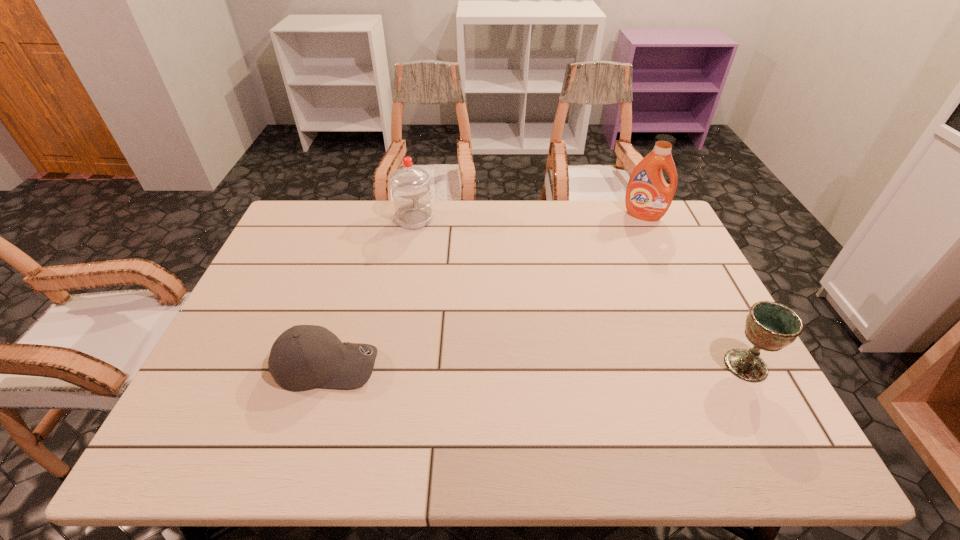
At what (x,y) coordinates should I click in order to perform the action: click on vacant region that satisfies the following two spatial constraints: 1. on the front side of the detergent; 2. on the right side of the second shortest object. Please return your answer as a coordinate pair (x, y). Looking at the image, I should click on (712, 365).

This screenshot has width=960, height=540. I want to click on free location that satisfies the following two spatial constraints: 1. on the front side of the water bottle; 2. on the right side of the third tallest object, so click(388, 365).